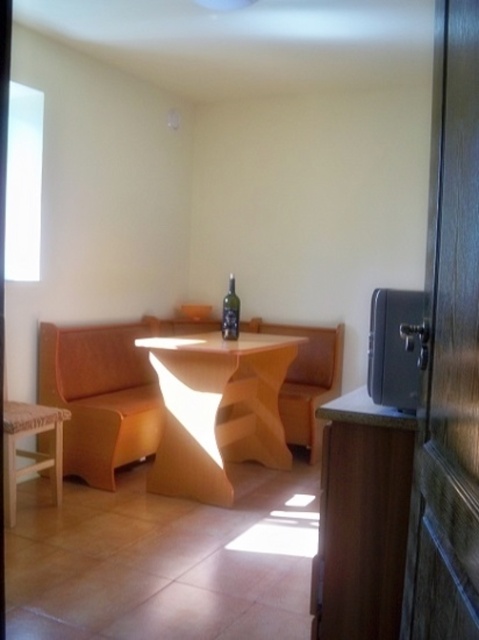
You are standing at the entrance of the room and want to place a new chair exactly where the matte orange table at center is located. Can you confirm the exact coordinates where you should position the chair?

The matte orange table at center is located at point coordinates (216, 410).

Looking at this image, you are planning to place a large potted plant in the room. The wooden armchair at center and the wooden stool at lower left are in the way. Which object should you move to make space for the plant?

You should move the wooden stool at lower left because it is smaller and easier to move out of the way compared to the bigger wooden armchair at center.